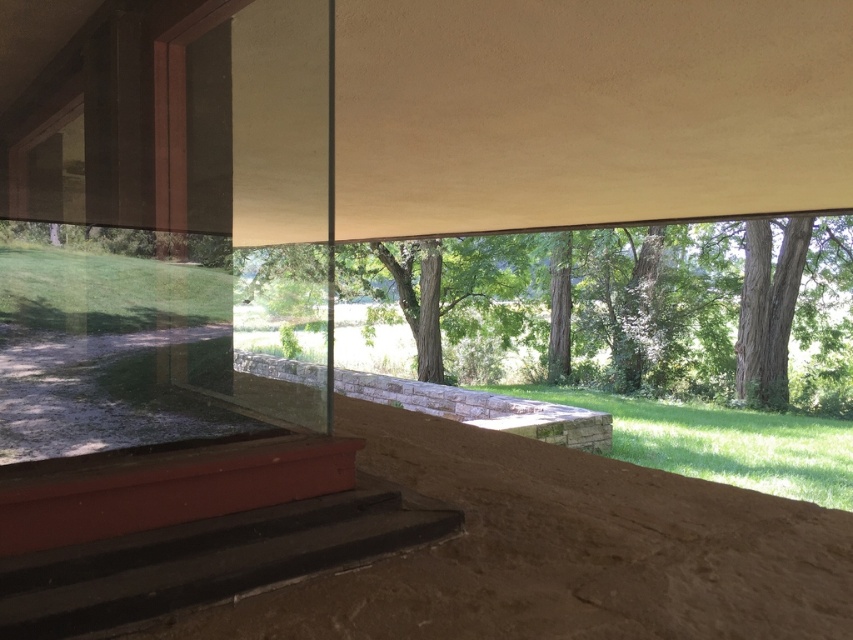
You are standing at the base of the steps leading up to the concrete area in the image. You want to walk towards the point labeled as point [495,307] and point [192,541]. Which point will you reach first?

You will reach point [192,541] first because point [495,307] is located behind it, meaning it is further away from your starting position at the base of the steps.

You are standing in front of the modern architectural design and want to locate the green leafy tree at center. According to the coordinates provided, where would you look to find it?

The green leafy tree at center is located at point coordinates of (624,307).

Based on the photo, you are standing at the bottom of the smooth black stairs at lower left and want to reach the green leafy tree at center. Which direction should you move to get closer to the tree?

The green leafy tree at center is located in the center of the scene, so you should move forward from the smooth black stairs at lower left to get closer to it.